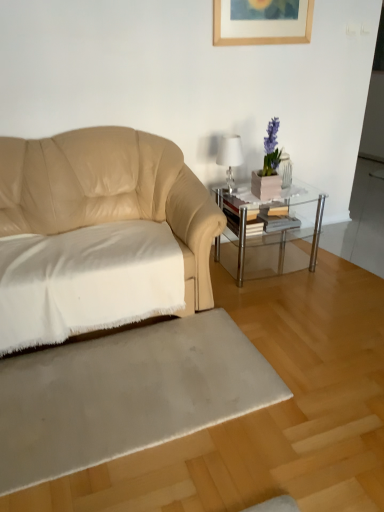
This screenshot has height=512, width=384. What do you see at coordinates (267, 220) in the screenshot?
I see `clear glass table at center` at bounding box center [267, 220].

The width and height of the screenshot is (384, 512). What are the coordinates of `white glossy table lamp at upper right` in the screenshot? It's located at (230, 156).

Describe the element at coordinates (125, 394) in the screenshot. I see `silky beige rug at lower center` at that location.

At what (x,y) coordinates should I click in order to perform the action: click on clear glass table at center. Please return your answer as a coordinate pair (x, y). Image resolution: width=384 pixels, height=512 pixels. Looking at the image, I should click on (267, 220).

This screenshot has width=384, height=512. I want to click on table on the right side of silky beige rug at lower center, so click(x=267, y=220).

Based on the photo, is clear glass table at center looking in the opposite direction of silky beige rug at lower center?

No, clear glass table at center is not facing away from silky beige rug at lower center.

In the scene shown: Which is in front, clear glass table at center or silky beige rug at lower center?

silky beige rug at lower center is more forward.

From a real-world perspective, is clear glass table at center physically below silky beige rug at lower center?

No.

Which point is more forward, (252, 197) or (53, 293)?

The point (53, 293) is closer.

What's the angular difference between clear glass table at center and white soft fabric at left's facing directions?

0.957 degrees separate the facing orientations of clear glass table at center and white soft fabric at left.

Can we say clear glass table at center lies outside white soft fabric at left?

Indeed, clear glass table at center is completely outside white soft fabric at left.

Is clear glass table at center taller or shorter than white soft fabric at left?

In the image, clear glass table at center appears to be taller than white soft fabric at left.

Which is in front, white glossy table lamp at upper right or clear glass table at center?

clear glass table at center is closer to the camera.

Can you confirm if white glossy table lamp at upper right is taller than clear glass table at center?

No.

I want to click on table lamp positioned vertically above the white soft fabric at left (from a real-world perspective), so click(x=230, y=156).

Could you tell me if white glossy table lamp at upper right is turned towards white soft fabric at left?

No, white glossy table lamp at upper right does not turn towards white soft fabric at left.

Based on the photo, considering the relative positions of white glossy table lamp at upper right and white soft fabric at left in the image provided, is white glossy table lamp at upper right to the left of white soft fabric at left from the viewer's perspective?

No.

Between white glossy table lamp at upper right and white soft fabric at left, which one has larger width?

Wider between the two is white soft fabric at left.

Is silky beige rug at lower center turned away from clear glass table at center?

silky beige rug at lower center does not have its back to clear glass table at center.

From a real-world perspective, is silky beige rug at lower center on top of clear glass table at center?

Incorrect, from a real-world perspective, silky beige rug at lower center is lower than clear glass table at center.

Looking at their sizes, would you say silky beige rug at lower center is wider or thinner than clear glass table at center?

In the image, silky beige rug at lower center appears to be wider than clear glass table at center.

Does point (163, 233) lie behind point (32, 435)?

Yes, point (163, 233) is behind point (32, 435).

Could you tell me if white soft fabric at left is turned towards silky beige rug at lower center?

No.

Is white soft fabric at left not inside silky beige rug at lower center?

Yes, white soft fabric at left is outside of silky beige rug at lower center.

From a real-world perspective, who is located higher, silky beige rug at lower center or white soft fabric at left?

white soft fabric at left, from a real-world perspective.

Which is closer to the camera, (223, 385) or (157, 303)?

The point (223, 385) is more forward.

Considering the relative positions of silky beige rug at lower center and white soft fabric at left in the image provided, is silky beige rug at lower center in front of white soft fabric at left?

Yes, silky beige rug at lower center is closer to the camera.

Does silky beige rug at lower center touch white soft fabric at left?

silky beige rug at lower center and white soft fabric at left are not in contact.

The image size is (384, 512). In order to click on flat below the clear glass table at center (from the image's perspective) in this screenshot , I will do `click(125, 394)`.

At what (x,y) coordinates should I click in order to perform the action: click on sheet in front of the clear glass table at center. Please return your answer as a coordinate pair (x, y). The width and height of the screenshot is (384, 512). Looking at the image, I should click on (86, 281).

Based on their spatial positions, is clear glass table at center or white soft fabric at left further from white glossy table lamp at upper right?

The object further to white glossy table lamp at upper right is white soft fabric at left.

Considering their positions, is clear glass table at center positioned further to white glossy table lamp at upper right than silky beige rug at lower center?

Among the two, silky beige rug at lower center is located further to white glossy table lamp at upper right.

Which object lies nearer to the anchor point white soft fabric at left, clear glass table at center or white glossy table lamp at upper right?

clear glass table at center lies closer to white soft fabric at left than the other object.

From the image, which object appears to be nearer to white glossy table lamp at upper right, silky beige rug at lower center or clear glass table at center?

The object closer to white glossy table lamp at upper right is clear glass table at center.

Estimate the real-world distances between objects in this image. Which object is further from clear glass table at center, white glossy table lamp at upper right or white soft fabric at left?

The object further to clear glass table at center is white soft fabric at left.

Which object lies further to the anchor point white glossy table lamp at upper right, white soft fabric at left or clear glass table at center?

Based on the image, white soft fabric at left appears to be further to white glossy table lamp at upper right.

Considering their positions, is white soft fabric at left positioned further to white glossy table lamp at upper right than silky beige rug at lower center?

silky beige rug at lower center is further to white glossy table lamp at upper right.

Based on their spatial positions, is white soft fabric at left or silky beige rug at lower center further from clear glass table at center?

silky beige rug at lower center is further to clear glass table at center.

Identify the location of flat between white soft fabric at left and clear glass table at center. (125, 394).

Where is `sheet that lies between white glossy table lamp at upper right and silky beige rug at lower center from top to bottom`? sheet that lies between white glossy table lamp at upper right and silky beige rug at lower center from top to bottom is located at coordinates (86, 281).

What are the coordinates of `table lamp between white soft fabric at left and clear glass table at center in the horizontal direction` in the screenshot? It's located at (230, 156).

At what (x,y) coordinates should I click in order to perform the action: click on table between white glossy table lamp at upper right and silky beige rug at lower center vertically. Please return your answer as a coordinate pair (x, y). Looking at the image, I should click on (267, 220).